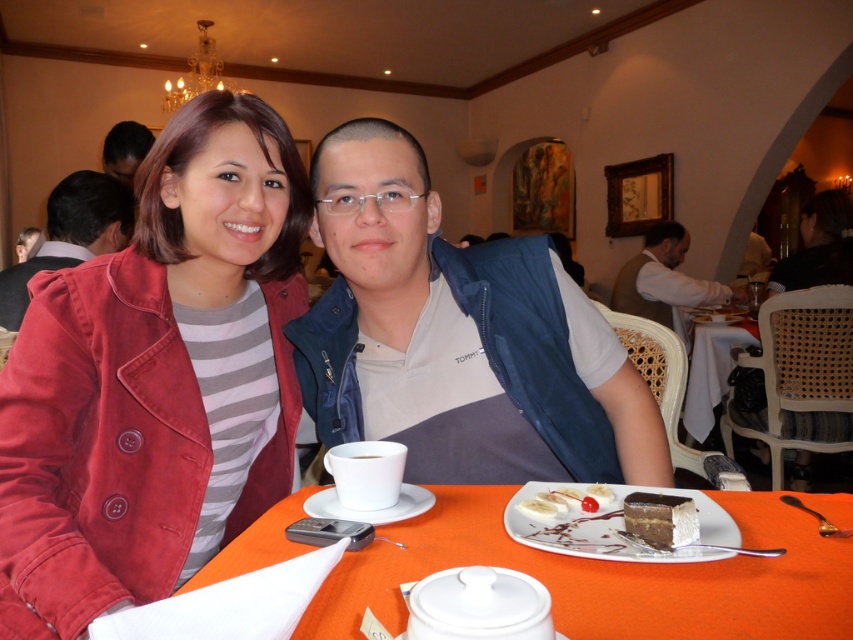
Question: Does denim jacket at center lie in front of orange fabric table at lower center?

Choices:
 (A) yes
 (B) no

Answer: (B)

Question: Observing the image, what is the correct spatial positioning of white ceramic plate at lower center in reference to white glossy plate at right?

Choices:
 (A) left
 (B) right

Answer: (A)

Question: Which of the following is the farthest from the observer?

Choices:
 (A) orange fabric table at lower center
 (B) blue fabric vest at center
 (C) dark brown hair at upper left

Answer: (C)

Question: Can you confirm if light brown vest at right is wider than chocolate frosted cake at center?

Choices:
 (A) yes
 (B) no

Answer: (A)

Question: Which point is closer to the camera taking this photo?

Choices:
 (A) (544, 515)
 (B) (721, 540)
 (C) (692, 392)

Answer: (B)

Question: Estimate the real-world distances between objects in this image. Which object is farther from the white ceramic saucer at lower center?

Choices:
 (A) denim jacket at center
 (B) chocolate frosted cake at center
 (C) dark brown hair at upper left
 (D) white ceramic plate at lower center

Answer: (C)